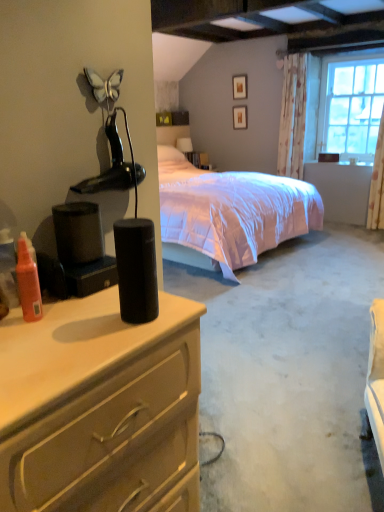
Question: From a real-world perspective, is black matte speaker at center under matte black speaker at left?

Choices:
 (A) no
 (B) yes

Answer: (A)

Question: Does black matte speaker at center contain matte black speaker at left?

Choices:
 (A) no
 (B) yes

Answer: (A)

Question: From the image's perspective, is black matte speaker at center located above matte black speaker at left?

Choices:
 (A) yes
 (B) no

Answer: (A)

Question: Can you confirm if black matte speaker at center is bigger than matte black speaker at left?

Choices:
 (A) no
 (B) yes

Answer: (A)

Question: Considering the relative sizes of black matte speaker at center and matte black speaker at left in the image provided, is black matte speaker at center smaller than matte black speaker at left?

Choices:
 (A) yes
 (B) no

Answer: (A)

Question: Is black matte speaker at center to the left of matte black speaker at left from the viewer's perspective?

Choices:
 (A) no
 (B) yes

Answer: (A)

Question: Is translucent orange spray bottle at left surrounding matte black box at upper center?

Choices:
 (A) no
 (B) yes

Answer: (A)

Question: Does translucent orange spray bottle at left have a greater height compared to matte black box at upper center?

Choices:
 (A) no
 (B) yes

Answer: (B)

Question: Is translucent orange spray bottle at left outside of matte black box at upper center?

Choices:
 (A) no
 (B) yes

Answer: (B)

Question: Does translucent orange spray bottle at left have a greater width compared to matte black box at upper center?

Choices:
 (A) no
 (B) yes

Answer: (A)

Question: Is translucent orange spray bottle at left closer to the viewer compared to matte black box at upper center?

Choices:
 (A) yes
 (B) no

Answer: (A)

Question: Is the position of translucent orange spray bottle at left more distant than that of matte black box at upper center?

Choices:
 (A) yes
 (B) no

Answer: (B)

Question: From the image's perspective, is clear glass window at upper right located beneath translucent orange spray bottle at left?

Choices:
 (A) yes
 (B) no

Answer: (B)